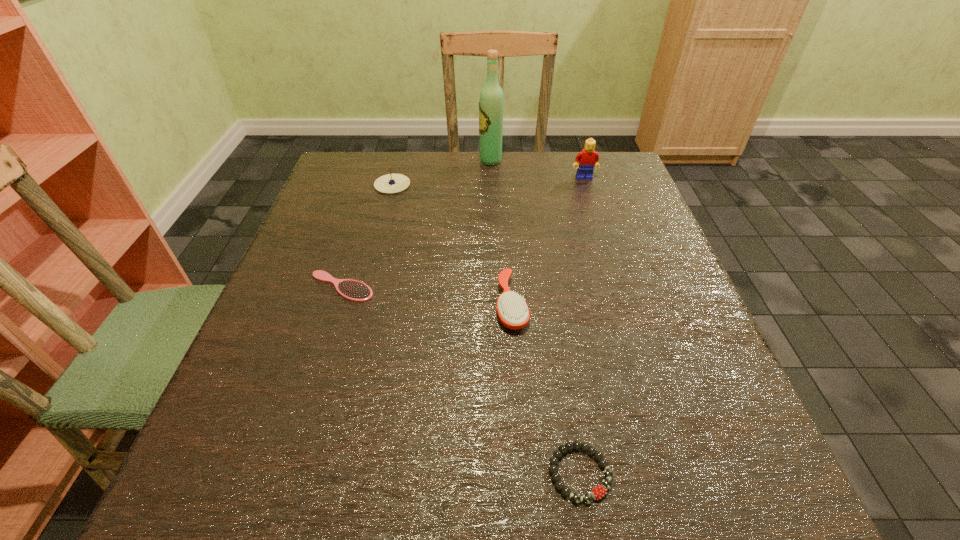
This screenshot has height=540, width=960. Identify the location of free space at the left edge. (364, 226).

Where is `vacant space at the right edge of the desktop`? Image resolution: width=960 pixels, height=540 pixels. vacant space at the right edge of the desktop is located at coordinates (686, 397).

Where is `blank area at the far left corner`? The image size is (960, 540). blank area at the far left corner is located at coordinates (356, 178).

This screenshot has width=960, height=540. In order to click on vacant area that lies between the right hairbrush and the fifth tallest object in this screenshot , I will do `click(426, 296)`.

The width and height of the screenshot is (960, 540). Identify the location of free point between the left hairbrush and the right hairbrush. (426, 296).

Where is `empty space that is in between the compass and the fourth tallest object`? This screenshot has width=960, height=540. empty space that is in between the compass and the fourth tallest object is located at coordinates (452, 245).

I want to click on vacant area that lies between the nearest object and the taller hairbrush, so click(x=545, y=389).

Locate an element on the screen. empty space that is in between the nearest object and the fourth tallest object is located at coordinates (545, 389).

Locate an element on the screen. The image size is (960, 540). empty location between the rightmost object and the second shortest object is located at coordinates (463, 232).

Find the location of a particular element. This screenshot has width=960, height=540. vacant space that is in between the compass and the wine bottle is located at coordinates (442, 173).